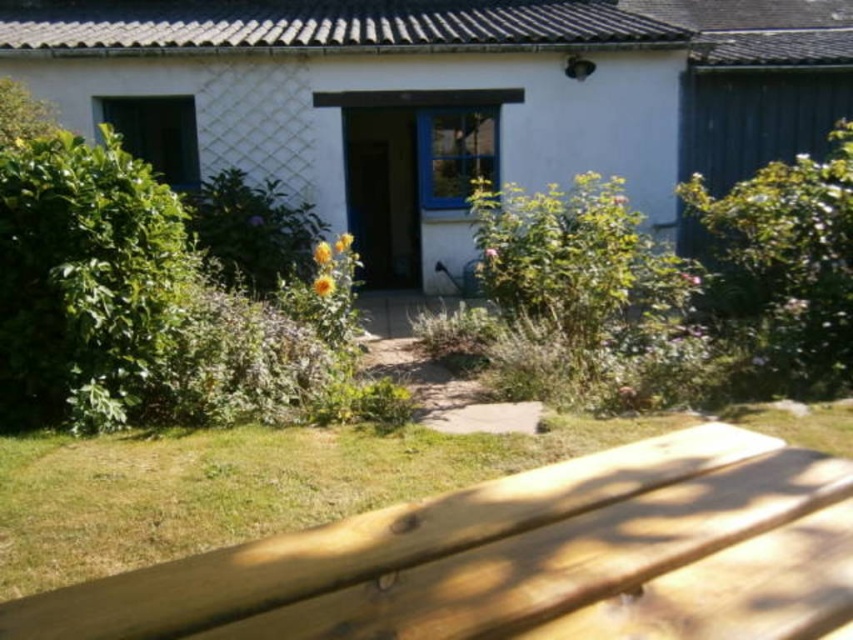
Question: Which object appears closest to the camera in this image?

Choices:
 (A) wooden bench at lower center
 (B) white painted wood cottage at center

Answer: (A)

Question: Which object is closer to the camera taking this photo?

Choices:
 (A) white painted wood cottage at center
 (B) wooden bench at lower center

Answer: (B)

Question: Is white painted wood cottage at center smaller than wooden bench at lower center?

Choices:
 (A) no
 (B) yes

Answer: (A)

Question: Does white painted wood cottage at center have a smaller size compared to wooden bench at lower center?

Choices:
 (A) yes
 (B) no

Answer: (B)

Question: Can you confirm if white painted wood cottage at center is thinner than wooden bench at lower center?

Choices:
 (A) no
 (B) yes

Answer: (A)